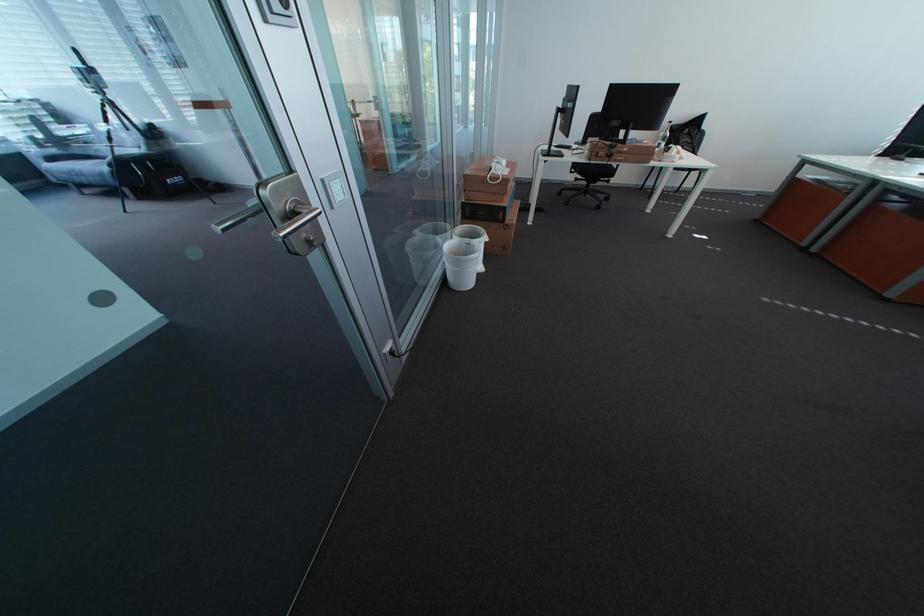
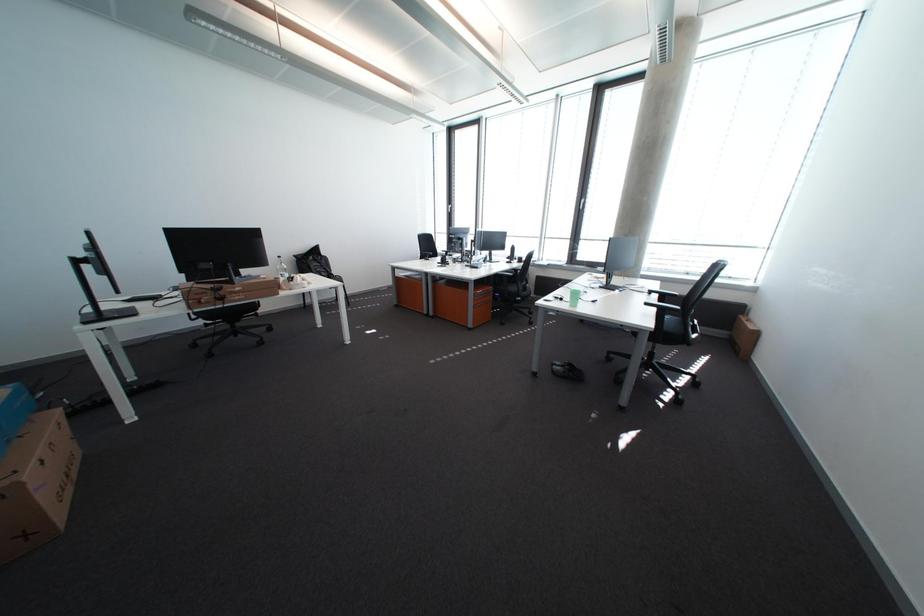
Question: The camera is either moving clockwise (left) or counter-clockwise (right) around the object. The first image is from the beginning of the video and the second image is from the end. Is the camera moving left or right when shooting the video?

Choices:
 (A) Left
 (B) Right

Answer: (A)